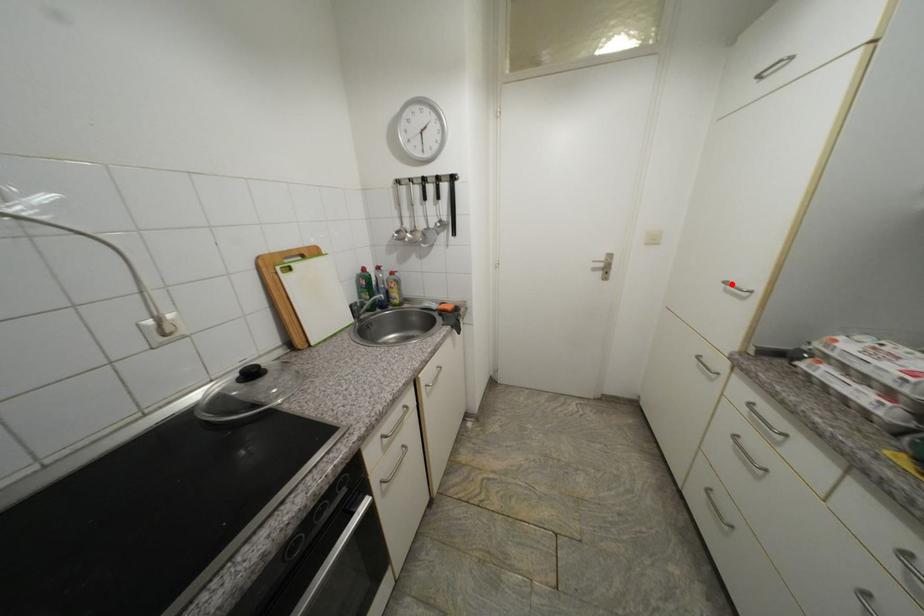
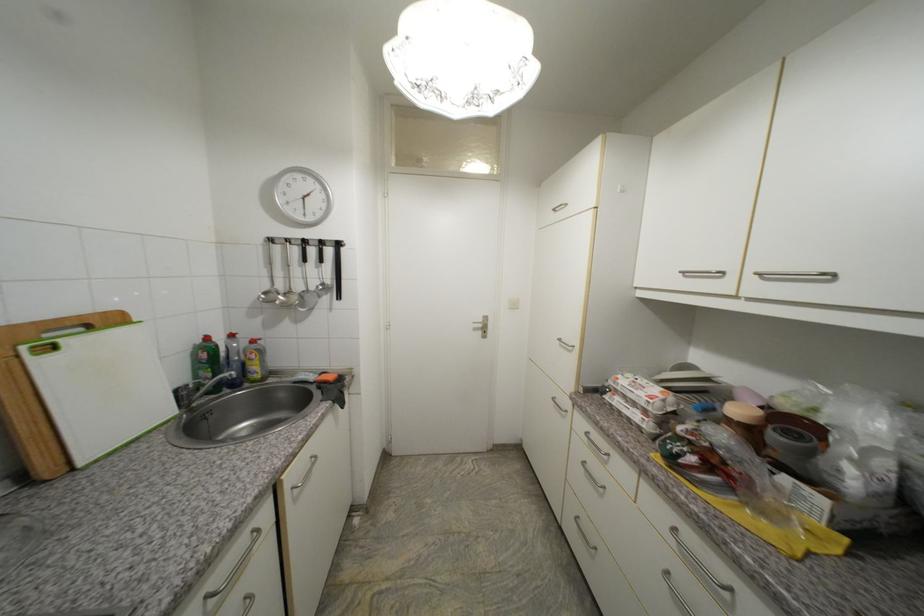
The point at the highlighted location is marked in the first image. Where is the corresponding point in the second image?

(565, 341)